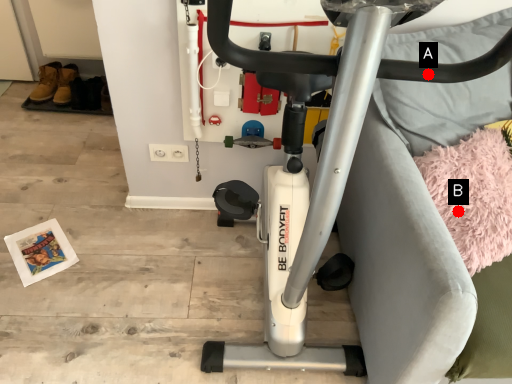
Question: Two points are circled on the image, labeled by A and B beside each circle. Which of the following is the closest to the observer?

Choices:
 (A) A is closer
 (B) B is closer

Answer: (A)